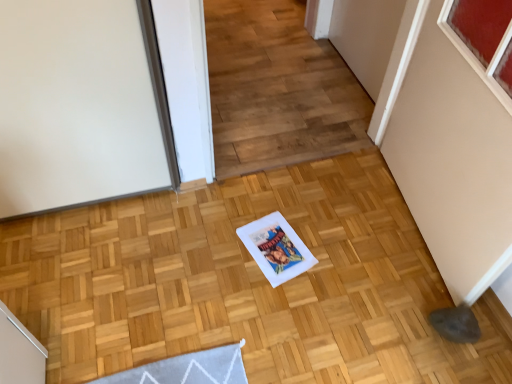
Find the location of `white glossy postcard at center`. white glossy postcard at center is located at coordinates (276, 248).

What is the approximate width of white glossy postcard at center?

The width of white glossy postcard at center is 8.25 inches.

Describe the element at coordinates (276, 248) in the screenshot. I see `white glossy postcard at center` at that location.

Where is `white glossy postcard at center`? The image size is (512, 384). white glossy postcard at center is located at coordinates (276, 248).